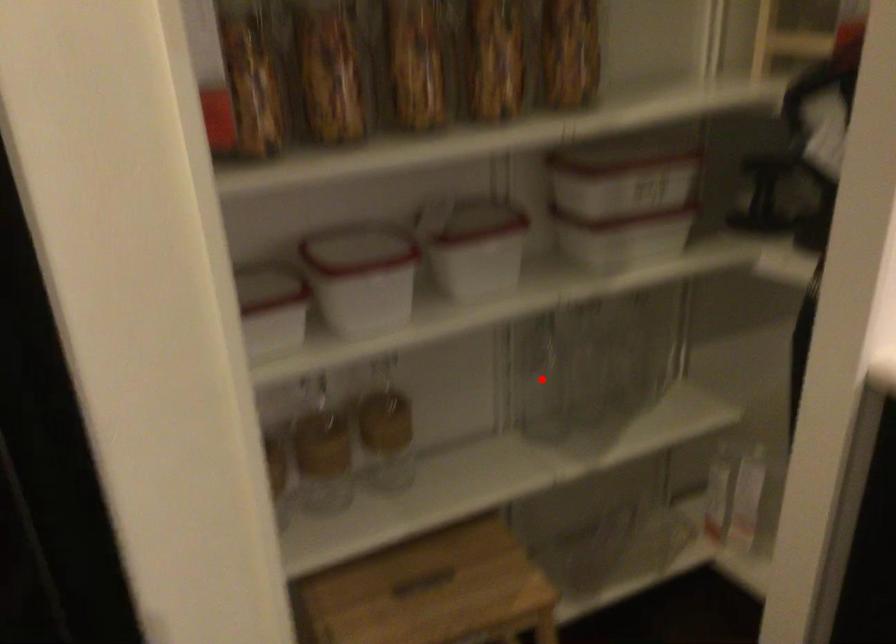
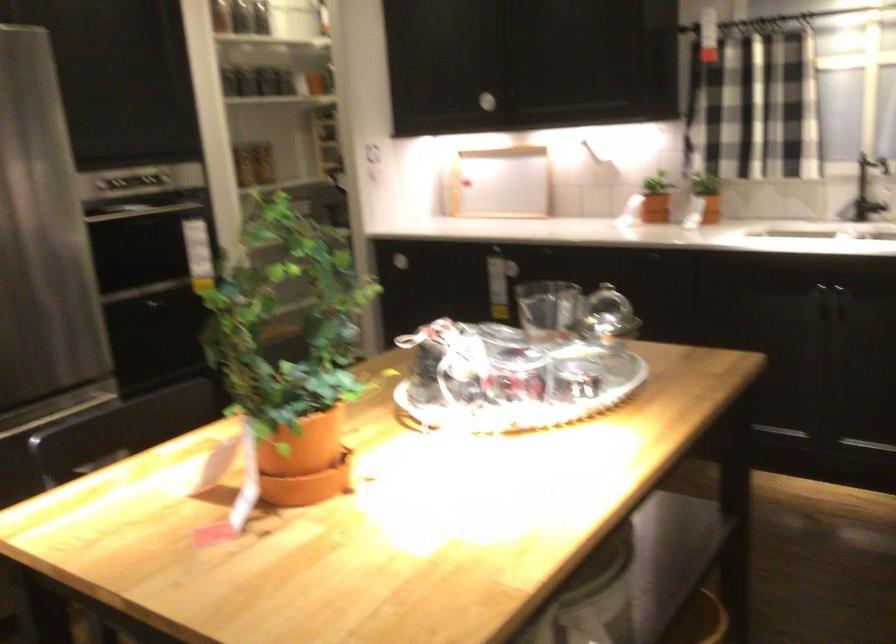
Question: I am providing you with two images of the same scene from different viewpoints. A red point is marked on the first image. Can you still see the location of the red point in image 2?

Choices:
 (A) Yes
 (B) No

Answer: (B)